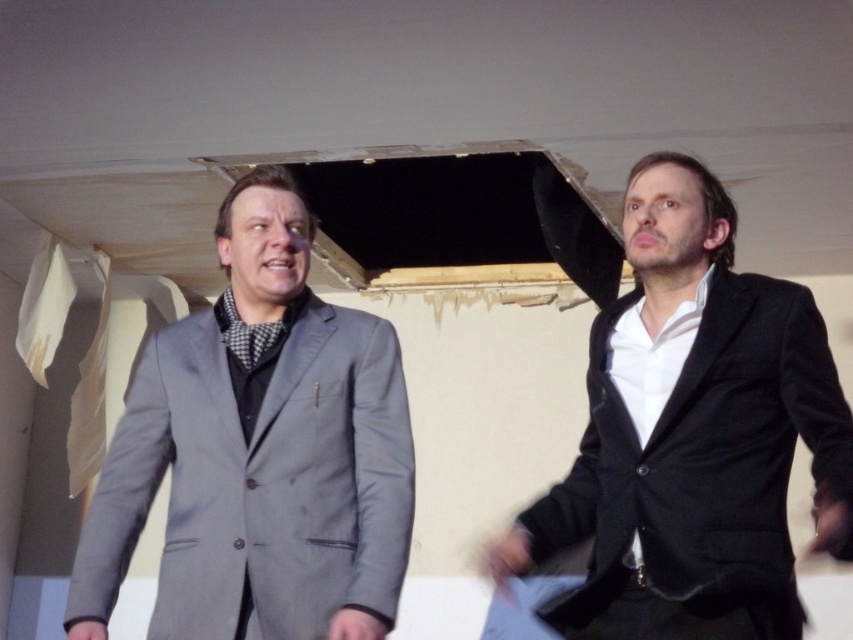
Between gray wool suit at center and black velvet suit at right, which one is positioned lower?

gray wool suit at center is lower down.

Is point (199, 388) positioned before point (759, 346)?

No, it is not.

Identify the location of gray wool suit at center. (259, 452).